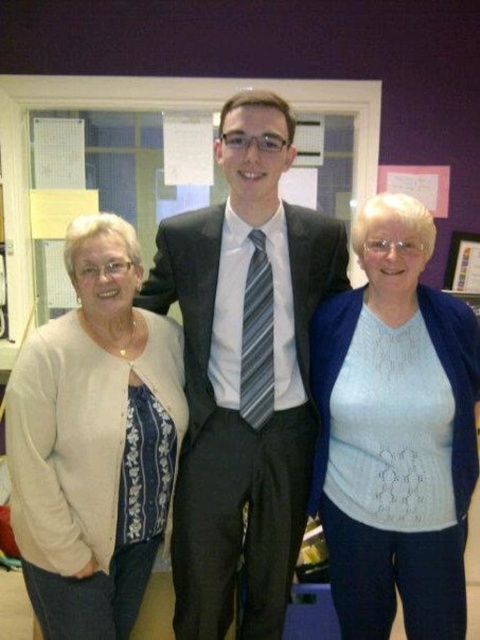
Question: Is white knit sweater at center to the right of white knit cardigan at left from the viewer's perspective?

Choices:
 (A) no
 (B) yes

Answer: (B)

Question: Considering the real-world distances, which object is closest to the white knit cardigan at left?

Choices:
 (A) matte black suit at center
 (B) white knit sweater at center

Answer: (A)

Question: Based on their relative distances, which object is farther from the white knit cardigan at left?

Choices:
 (A) white knit sweater at center
 (B) matte black suit at center

Answer: (A)

Question: From the image, what is the correct spatial relationship of matte black suit at center in relation to white knit sweater at center?

Choices:
 (A) left
 (B) right

Answer: (A)

Question: Considering the real-world distances, which object is closest to the white knit sweater at center?

Choices:
 (A) white knit cardigan at left
 (B) matte black suit at center

Answer: (B)

Question: Can you confirm if white knit sweater at center is positioned below white knit cardigan at left?

Choices:
 (A) no
 (B) yes

Answer: (A)